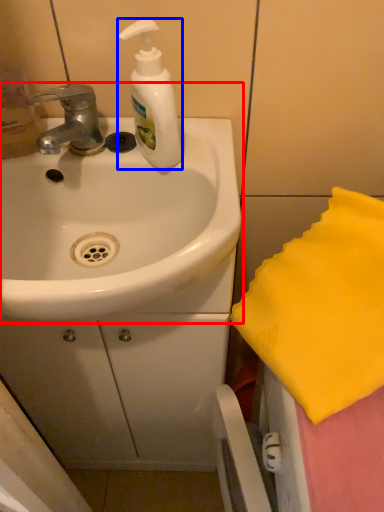
Question: Which point is closer to the camera, sink (highlighted by a red box) or soap dispenser (highlighted by a blue box)?

Choices:
 (A) sink
 (B) soap dispenser

Answer: (A)